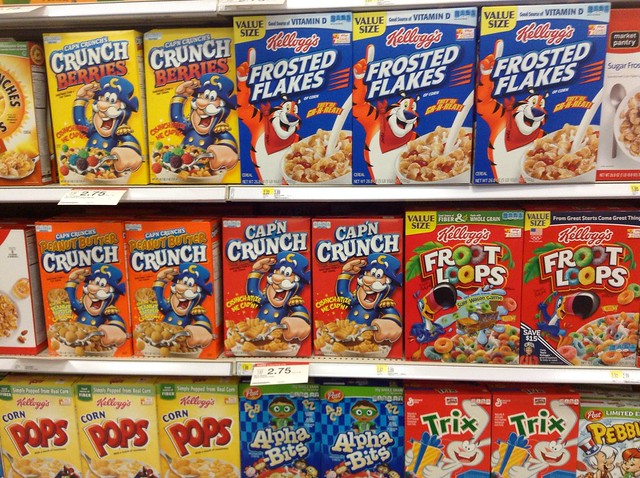
At what (x,y) coordinates should I click in order to perform the action: click on cereal boxes on bottom shelf. Please return your answer as a coordinate pair (x, y). Looking at the image, I should click on (50, 444), (118, 434), (189, 426), (256, 424), (346, 422), (458, 422), (557, 424), (598, 428).